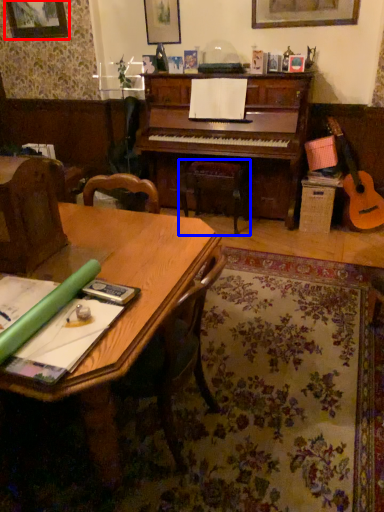
Question: Among these objects, which one is farthest to the camera, picture frame (highlighted by a red box) or music stool (highlighted by a blue box)?

Choices:
 (A) picture frame
 (B) music stool

Answer: (A)